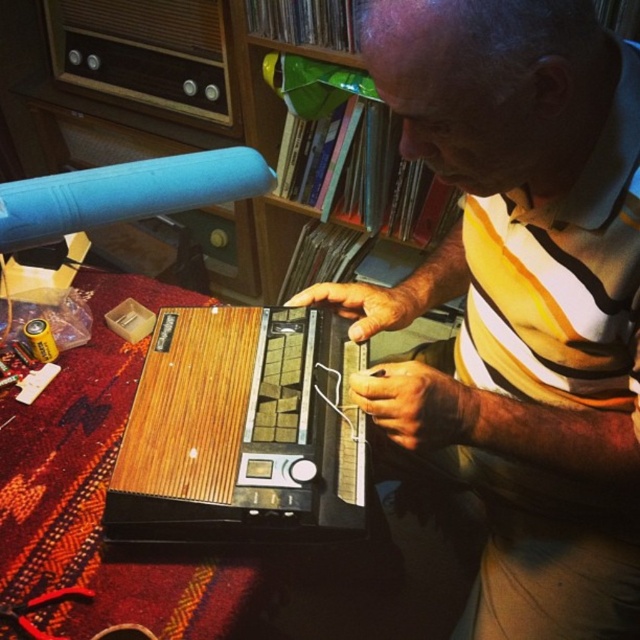
Based on the scene description, where is the wooden radio at center located in relation to the wooden bookshelf at upper center?

The wooden radio at center is located below the wooden bookshelf at upper center.

The man is wearing a yellow striped shirt at center and holding a wooden radio at center. Which item is closer to the viewer?

The yellow striped shirt at center is positioned over the wooden radio at center, so it is closer to the viewer.